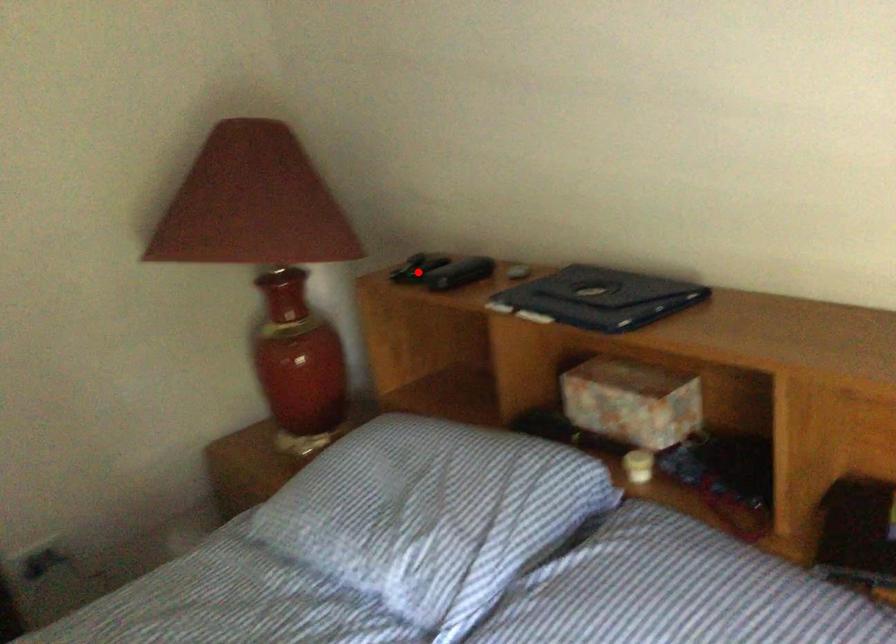
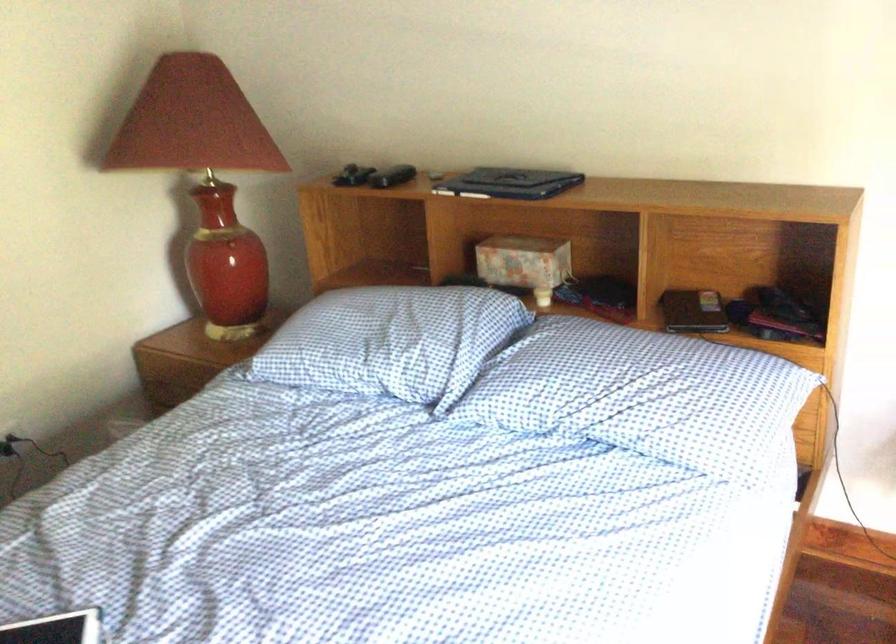
Where in the second image is the point corresponding to the highlighted location from the first image?

(352, 176)